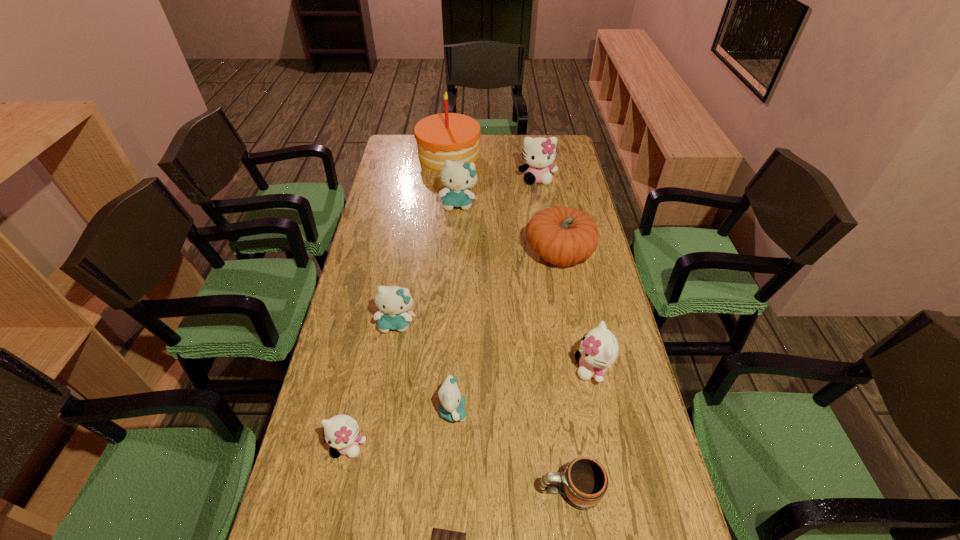
I want to click on orange birthday cake, so (x=446, y=136).

You are a GUI agent. You are given a task and a screenshot of the screen. Output one action in this format:
    pyautogui.click(x=<x>, y=<y>)
    Task: Click on the tallest object
    
    Given the screenshot: What is the action you would take?
    pyautogui.click(x=446, y=136)

Find the location of a particular element. the third farthest object is located at coordinates [x=457, y=176].

This screenshot has width=960, height=540. In order to click on the fifth nearest kitten in this screenshot , I will do `click(457, 176)`.

Identify the location of the farthest kitten. (539, 153).

Locate an element on the screen. Image resolution: width=960 pixels, height=540 pixels. the biggest white kitten is located at coordinates (539, 153).

Identify the location of pumpkin. The height and width of the screenshot is (540, 960). (563, 236).

You are a GUI agent. You are given a task and a screenshot of the screen. Output one action in this format:
    pyautogui.click(x=<x>, y=<y>)
    Task: Click on the fourth farthest object
    
    Given the screenshot: What is the action you would take?
    pyautogui.click(x=563, y=236)

Locate an element on the screen. the sixth farthest object is located at coordinates (599, 348).

At what (x,y) coordinates should I click in order to perform the action: click on the fourth farthest kitten. Please return your answer as a coordinate pair (x, y). Image resolution: width=960 pixels, height=540 pixels. Looking at the image, I should click on (599, 348).